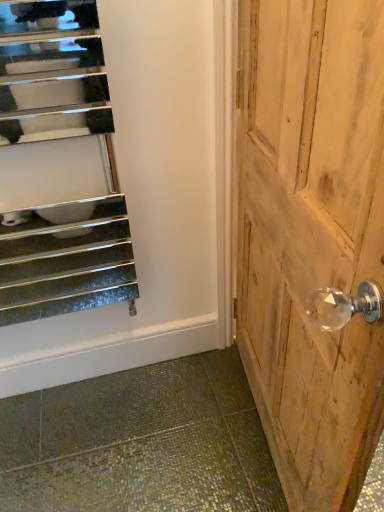
Image resolution: width=384 pixels, height=512 pixels. In order to click on wooden door handle at right in this screenshot , I will do `click(311, 236)`.

This screenshot has height=512, width=384. Describe the element at coordinates (311, 236) in the screenshot. I see `wooden door handle at right` at that location.

Measure the distance between wooden door handle at right and camera.

The distance of wooden door handle at right from camera is 19.36 inches.

This screenshot has height=512, width=384. Describe the element at coordinates (57, 143) in the screenshot. I see `polished chrome radiator at left` at that location.

Where is `polished chrome radiator at left`? This screenshot has width=384, height=512. polished chrome radiator at left is located at coordinates (57, 143).

I want to click on wooden door handle at right, so point(311,236).

From the picture: Which object is positioned more to the right, wooden door handle at right or polished chrome radiator at left?

Positioned to the right is wooden door handle at right.

Is wooden door handle at right in front of polished chrome radiator at left?

That is True.

Which is behind, point (361, 167) or point (108, 146)?

The point (108, 146) is farther.

From the image's perspective, is wooden door handle at right on top of polished chrome radiator at left?

Incorrect, from the image's perspective, wooden door handle at right is lower than polished chrome radiator at left.

From a real-world perspective, between wooden door handle at right and polished chrome radiator at left, who is vertically higher?

polished chrome radiator at left is physically above.

Is wooden door handle at right wider than polished chrome radiator at left?

Correct, the width of wooden door handle at right exceeds that of polished chrome radiator at left.

From the picture: Considering the sizes of objects wooden door handle at right and polished chrome radiator at left in the image provided, who is taller, wooden door handle at right or polished chrome radiator at left?

wooden door handle at right is taller.

Looking at the image, does wooden door handle at right seem bigger or smaller compared to polished chrome radiator at left?

In the image, wooden door handle at right appears to be larger than polished chrome radiator at left.

Can we say wooden door handle at right lies outside polished chrome radiator at left?

Yes, wooden door handle at right is outside of polished chrome radiator at left.

Is wooden door handle at right with polished chrome radiator at left?

There is a gap between wooden door handle at right and polished chrome radiator at left.

Is wooden door handle at right facing towards polished chrome radiator at left?

No, wooden door handle at right is not aimed at polished chrome radiator at left.

How different are the orientations of wooden door handle at right and polished chrome radiator at left in degrees?

wooden door handle at right and polished chrome radiator at left are facing 7.33 degrees away from each other.

Where is `stairs on the left of wooden door handle at right`? stairs on the left of wooden door handle at right is located at coordinates (57, 143).

Can you confirm if polished chrome radiator at left is positioned to the left of wooden door handle at right?

Indeed, polished chrome radiator at left is positioned on the left side of wooden door handle at right.

Is polished chrome radiator at left further to the viewer compared to wooden door handle at right?

Yes, it is.

Which is nearer, (21, 121) or (353, 251)?

Clearly, point (21, 121) is more distant from the camera than point (353, 251).

From the image's perspective, does polished chrome radiator at left appear lower than wooden door handle at right?

No.

From a real-world perspective, which is physically above, polished chrome radiator at left or wooden door handle at right?

polished chrome radiator at left is physically above.

Considering the relative sizes of polished chrome radiator at left and wooden door handle at right in the image provided, is polished chrome radiator at left thinner than wooden door handle at right?

Yes.

Between polished chrome radiator at left and wooden door handle at right, which one has more height?

wooden door handle at right.

Who is smaller, polished chrome radiator at left or wooden door handle at right?

polished chrome radiator at left.

Can wooden door handle at right be found inside polished chrome radiator at left?

No, wooden door handle at right is not a part of polished chrome radiator at left.

Is polished chrome radiator at left placed right next to wooden door handle at right?

No.

Is polished chrome radiator at left facing towards wooden door handle at right?

No.

How different are the orientations of polished chrome radiator at left and wooden door handle at right in degrees?

There is a 7.33-degree angle between the facing directions of polished chrome radiator at left and wooden door handle at right.

In the image, there is a polished chrome radiator at left. Find the location of `door below it (from a real-world perspective)`. door below it (from a real-world perspective) is located at coordinates tap(311, 236).

The width and height of the screenshot is (384, 512). I want to click on door in front of the polished chrome radiator at left, so click(311, 236).

Find the location of `door below the polished chrome radiator at left (from a real-world perspective)`. door below the polished chrome radiator at left (from a real-world perspective) is located at coordinates point(311,236).